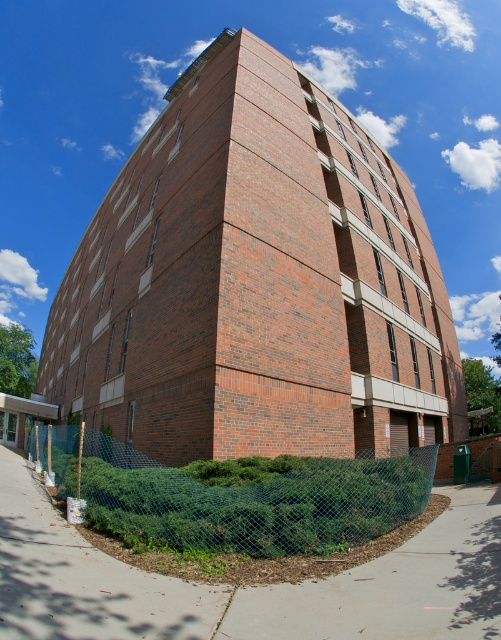
Is point (125, 563) farther from camera compared to point (233, 506)?

No, it is in front of (233, 506).

Looking at this image, can you confirm if gray concrete pavement at lower center is taller than blue mesh fence at lower left?

No.

Is point (30, 547) positioned before point (184, 531)?

Yes.

Where is `gray concrete pavement at lower center`? This screenshot has width=501, height=640. gray concrete pavement at lower center is located at coordinates (245, 586).